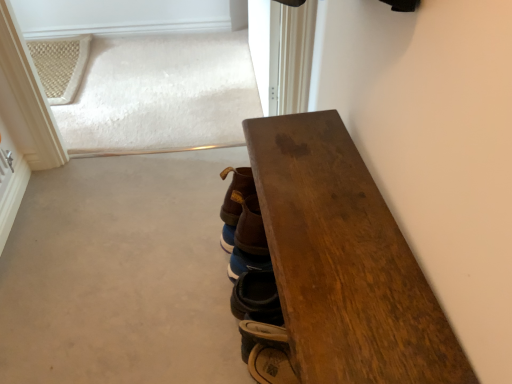
Question: Is brown leather boot at center, marked as the first footwear in a top-to-bottom arrangement, wider than wooden table at right?

Choices:
 (A) no
 (B) yes

Answer: (A)

Question: From the image's perspective, is brown leather boot at center, marked as the first footwear in a top-to-bottom arrangement, beneath wooden table at right?

Choices:
 (A) no
 (B) yes

Answer: (A)

Question: Considering the relative sizes of brown leather boot at center, marked as the first footwear in a top-to-bottom arrangement, and wooden table at right in the image provided, is brown leather boot at center, marked as the first footwear in a top-to-bottom arrangement, smaller than wooden table at right?

Choices:
 (A) no
 (B) yes

Answer: (B)

Question: Considering the relative sizes of brown leather boot at center, marked as the 2th footwear in a bottom-to-top arrangement, and wooden table at right in the image provided, is brown leather boot at center, marked as the 2th footwear in a bottom-to-top arrangement, taller than wooden table at right?

Choices:
 (A) yes
 (B) no

Answer: (B)

Question: Can you confirm if brown leather boot at center, marked as the 2th footwear in a bottom-to-top arrangement, is thinner than wooden table at right?

Choices:
 (A) no
 (B) yes

Answer: (B)

Question: Could you tell me if brown leather boot at center, marked as the 2th footwear in a bottom-to-top arrangement, is facing wooden table at right?

Choices:
 (A) yes
 (B) no

Answer: (B)

Question: Is brown leather boot at center, marked as the 2th footwear in a bottom-to-top arrangement, thinner than brown leather boot at lower center, which appears as the 1th footwear when ordered from the bottom?

Choices:
 (A) yes
 (B) no

Answer: (B)

Question: Is brown leather boot at center, marked as the 2th footwear in a bottom-to-top arrangement, smaller than brown leather boot at lower center, which ranks as the 2th footwear in top-to-bottom order?

Choices:
 (A) no
 (B) yes

Answer: (A)

Question: From a real-world perspective, is brown leather boot at center, marked as the 2th footwear in a bottom-to-top arrangement, below brown leather boot at lower center, which ranks as the 2th footwear in top-to-bottom order?

Choices:
 (A) no
 (B) yes

Answer: (A)

Question: Are brown leather boot at center, marked as the first footwear in a top-to-bottom arrangement, and brown leather boot at lower center, which appears as the 1th footwear when ordered from the bottom, making contact?

Choices:
 (A) yes
 (B) no

Answer: (A)

Question: From the image's perspective, is brown leather boot at center, marked as the 2th footwear in a bottom-to-top arrangement, below brown leather boot at lower center, which appears as the 1th footwear when ordered from the bottom?

Choices:
 (A) yes
 (B) no

Answer: (B)

Question: Is there a large distance between brown leather boot at center, marked as the first footwear in a top-to-bottom arrangement, and brown leather boot at lower center, which ranks as the 2th footwear in top-to-bottom order?

Choices:
 (A) yes
 (B) no

Answer: (B)

Question: Does brown leather boot at lower center, which appears as the 1th footwear when ordered from the bottom, have a lesser height compared to wooden table at right?

Choices:
 (A) no
 (B) yes

Answer: (B)